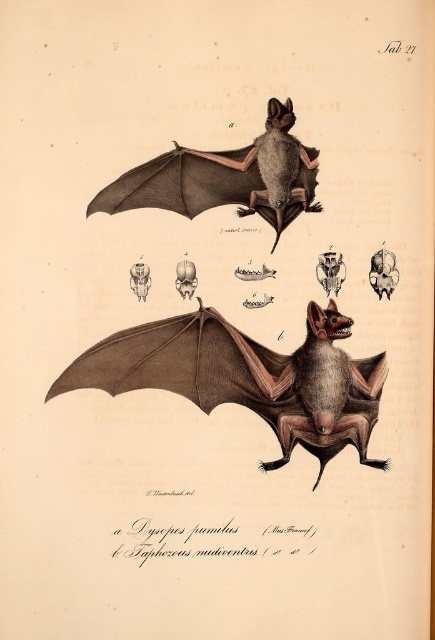
Question: Which object is closer to the camera taking this photo?

Choices:
 (A) brown textured bat at center
 (B) brown matte bat at upper center

Answer: (B)

Question: Can you confirm if brown textured bat at center is positioned below brown matte bat at upper center?

Choices:
 (A) yes
 (B) no

Answer: (A)

Question: Does brown textured bat at center come in front of brown matte bat at upper center?

Choices:
 (A) yes
 (B) no

Answer: (B)

Question: Considering the relative positions of brown textured bat at center and brown matte bat at upper center in the image provided, where is brown textured bat at center located with respect to brown matte bat at upper center?

Choices:
 (A) below
 (B) above

Answer: (A)